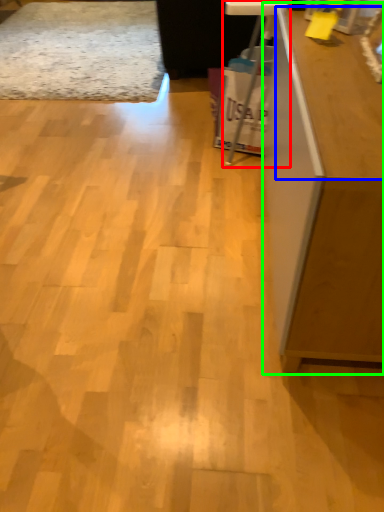
Question: Based on their relative distances, which object is farther from computer desk (highlighted by a red box)? Choose from counter top (highlighted by a blue box) and furniture (highlighted by a green box).

Choices:
 (A) counter top
 (B) furniture

Answer: (B)